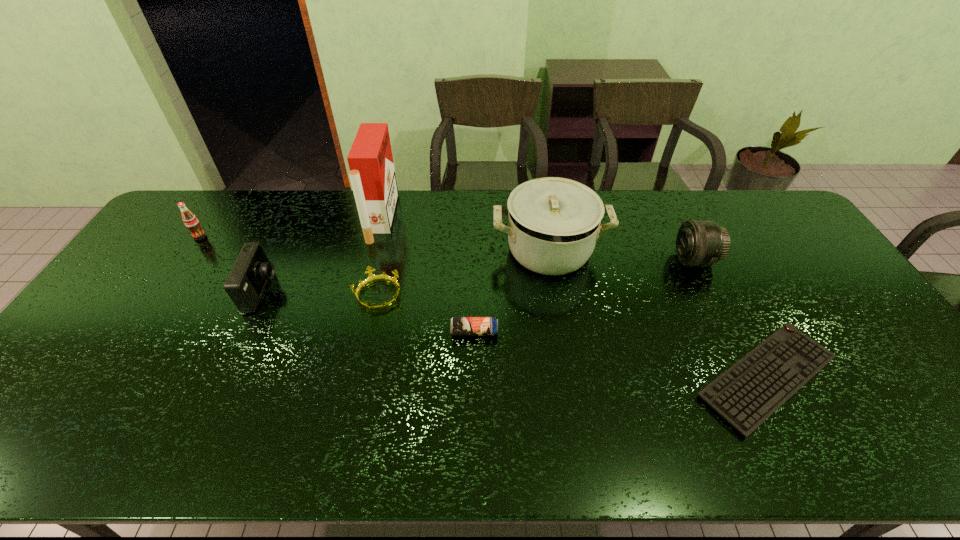
The height and width of the screenshot is (540, 960). I want to click on free space located 0.270m on the front-facing side of the telephoto lens, so click(588, 260).

The width and height of the screenshot is (960, 540). I want to click on vacant space located on the front-facing side of the telephoto lens, so click(582, 260).

The image size is (960, 540). I want to click on vacant area situated on the front-facing side of the telephoto lens, so click(x=572, y=260).

Identify the location of vacant area situated on the right of the soda. The image size is (960, 540). (239, 237).

What are the coordinates of `vacant space located on the front-facing side of the second object from left to right` in the screenshot? It's located at [378, 291].

Locate an element on the screen. Image resolution: width=960 pixels, height=540 pixels. free spot located on the right of the crown is located at coordinates (440, 295).

Identify the location of vacant position located 0.370m on the left of the beer can. This screenshot has width=960, height=540. (314, 332).

At what (x,y) coordinates should I click in order to perform the action: click on free region located 0.280m on the back of the shortest object. Please return your answer as a coordinate pair (x, y). This screenshot has height=540, width=960. Looking at the image, I should click on (704, 255).

At what (x,y) coordinates should I click in order to perform the action: click on cigarette case at the far edge. Please return your answer as a coordinate pair (x, y). The height and width of the screenshot is (540, 960). Looking at the image, I should click on (372, 174).

This screenshot has width=960, height=540. Find the location of `saucepan positioned at the far edge`. saucepan positioned at the far edge is located at coordinates (553, 223).